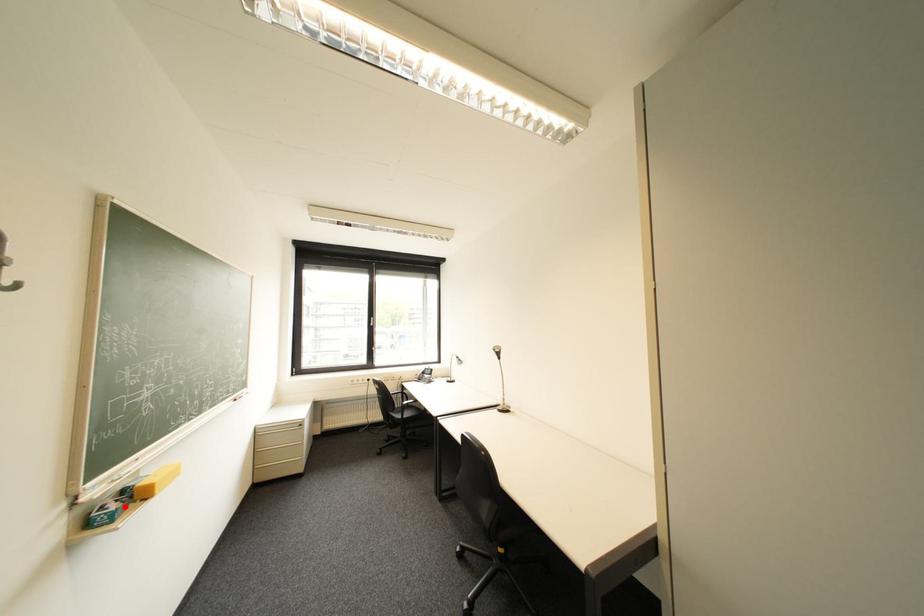
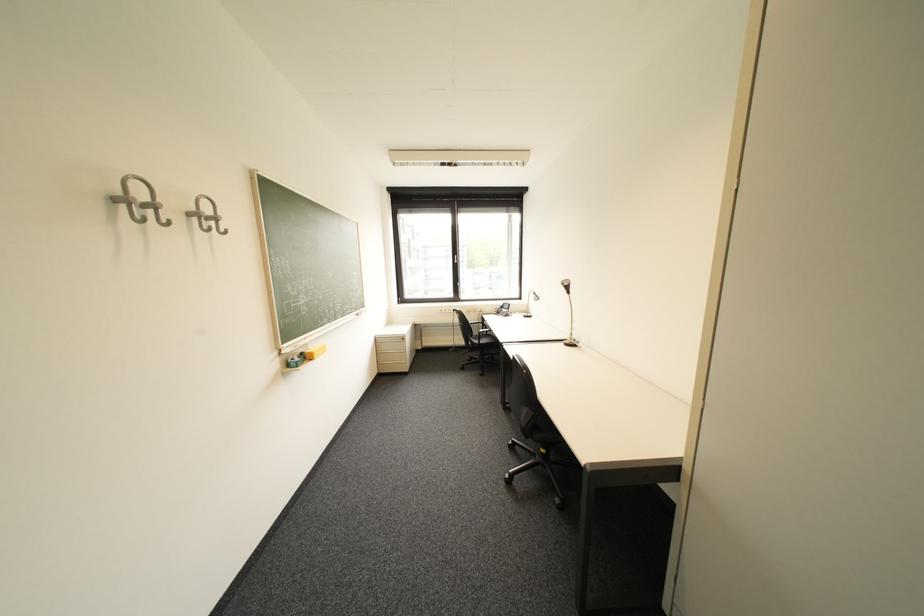
The point at the highlighted location is marked in the first image. Where is the corresponding point in the second image?

(308, 360)